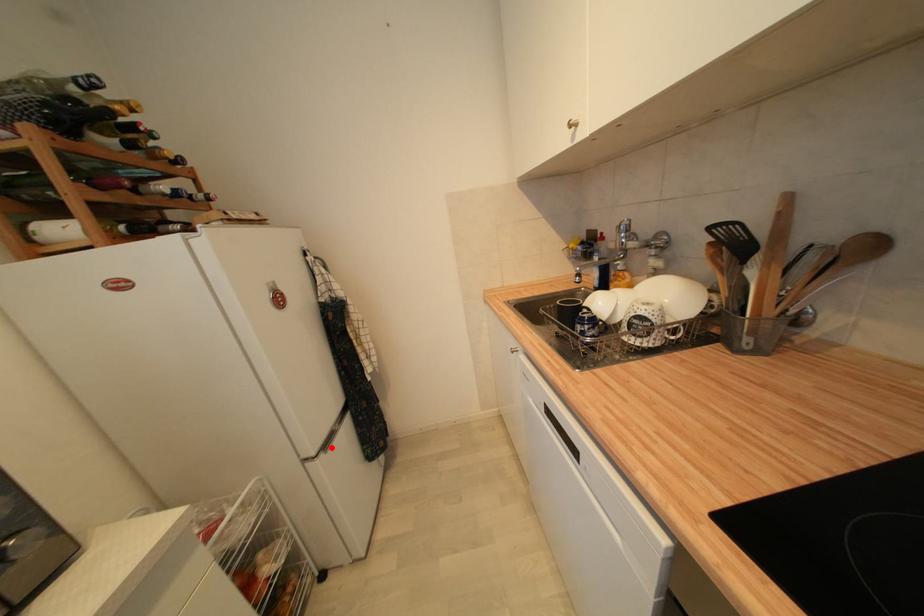
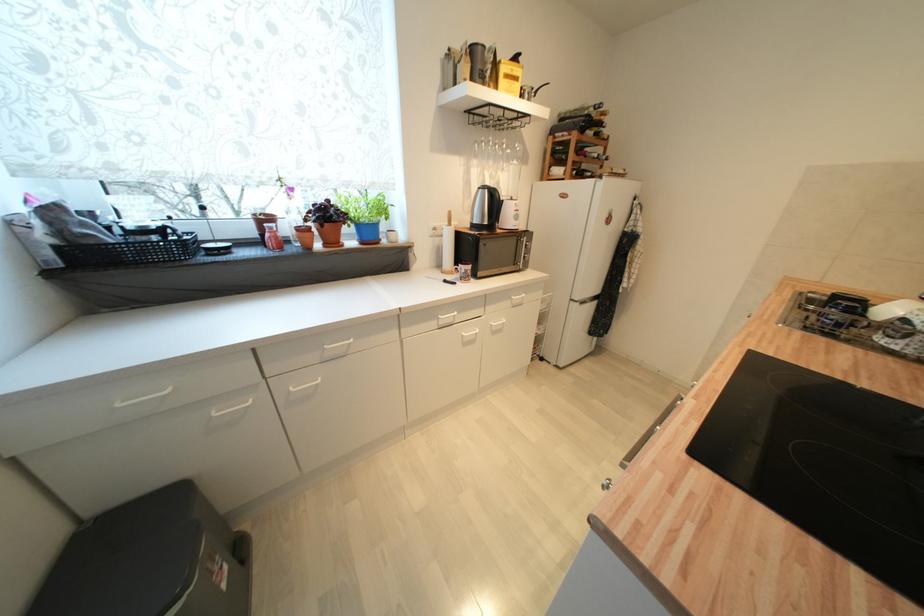
Question: A red point is marked in image1. In image2, is the corresponding 3D point closer to the camera or farther? Reply with the corresponding letter.

Choices:
 (A) The corresponding 3D point is closer.
 (B) The corresponding 3D point is farther.

Answer: (B)